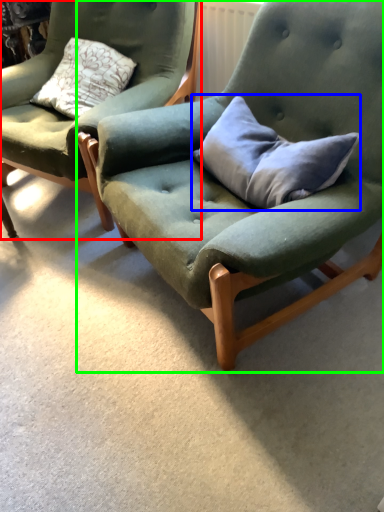
Question: Based on their relative distances, which object is farther from chair (highlighted by a red box)? Choose from pillow (highlighted by a blue box) and chair (highlighted by a green box).

Choices:
 (A) pillow
 (B) chair

Answer: (A)